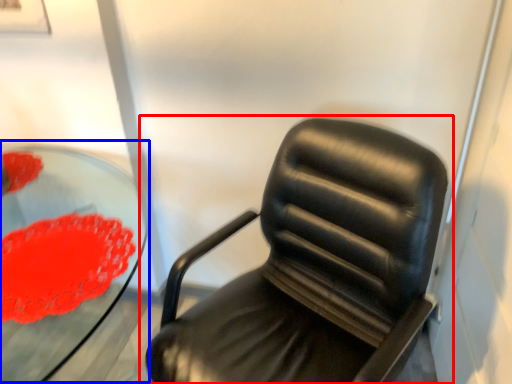
Question: Which of the following is the farthest to the observer, chair (highlighted by a red box) or round table (highlighted by a blue box)?

Choices:
 (A) chair
 (B) round table

Answer: (B)